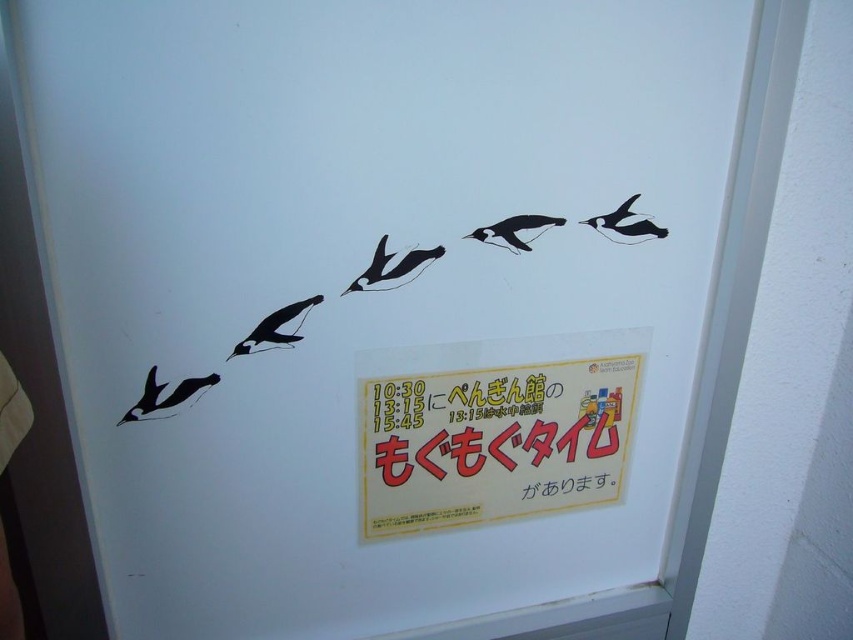
You are at the Penguin House and see the black glossy penguin at center and the black matte penguin at lower left. Which penguin is placed higher on the wall?

The black glossy penguin at center is positioned over the black matte penguin at lower left, so it is placed higher on the wall.

You are planning to hang a new rectangular poster that is 20 cm wide on the white wall. The poster must be placed between the black paper at lower center and the black glossy penguin at upper center. Considering their widths, will the poster fit horizontally between them?

The black paper at lower center is wider than the black glossy penguin at upper center. However, the exact distance between them isn generated from the provided information. Therefore, it is impossible to determine if the poster will fit horizontally between them based on the given details.